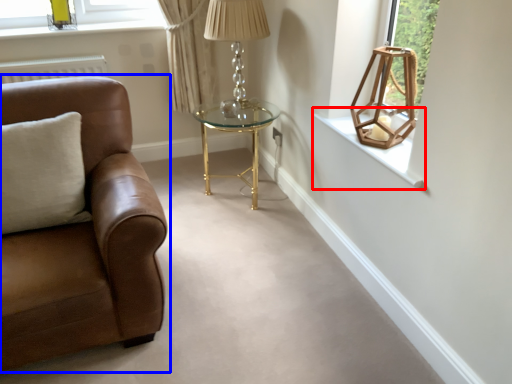
Question: Which object is further to the camera taking this photo, window sill (highlighted by a red box) or studio couch (highlighted by a blue box)?

Choices:
 (A) window sill
 (B) studio couch

Answer: (A)